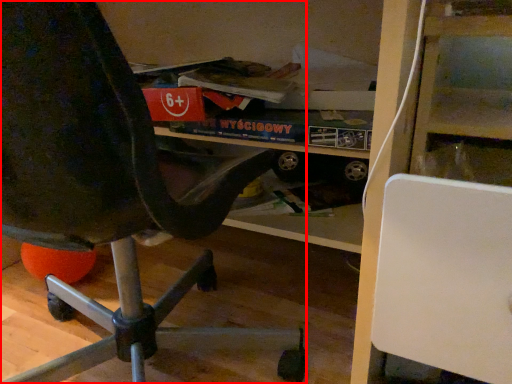
Question: From the image's perspective, what is the correct spatial positioning of chair (annotated by the red box) in reference to shelf?

Choices:
 (A) above
 (B) below

Answer: (A)